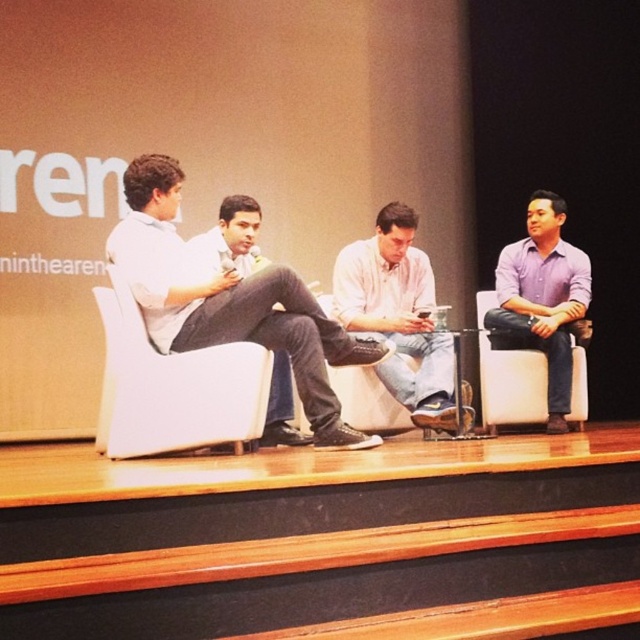
Does white fabric armchair at center appear over white cotton shirt at center?

Incorrect, white fabric armchair at center is not positioned above white cotton shirt at center.

Can you confirm if white fabric armchair at center is bigger than white cotton shirt at center?

No, white fabric armchair at center is not bigger than white cotton shirt at center.

The height and width of the screenshot is (640, 640). I want to click on white fabric armchair at center, so click(x=172, y=387).

Based on the photo, does white matte shirt at center have a larger size compared to white cotton shirt at center?

Indeed, white matte shirt at center has a larger size compared to white cotton shirt at center.

Which is above, white matte shirt at center or white cotton shirt at center?

white matte shirt at center is higher up.

Which is in front, point (157, 179) or point (449, 372)?

Point (157, 179)

What are the coordinates of `white matte shirt at center` in the screenshot? It's located at (228, 301).

Does purple matte shirt at right come in front of dark gray jeans at center?

No.

Measure the distance from purple matte shirt at right to dark gray jeans at center.

purple matte shirt at right and dark gray jeans at center are 5.88 feet apart from each other.

Who is more distant from viewer, (x=563, y=294) or (x=288, y=410)?

The point (x=563, y=294) is behind.

I want to click on purple matte shirt at right, so click(541, 298).